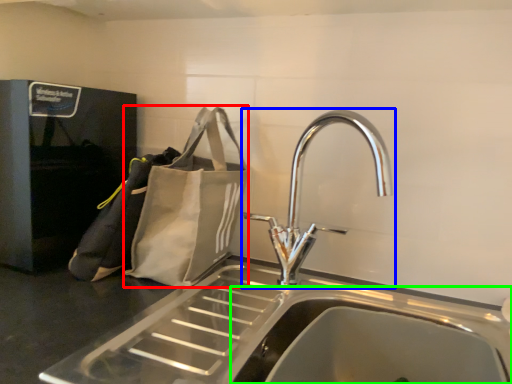
Question: Which object is positioned farthest from pouch (highlighted by a red box)? Select from tap (highlighted by a blue box) and sink (highlighted by a green box).

Choices:
 (A) tap
 (B) sink

Answer: (B)